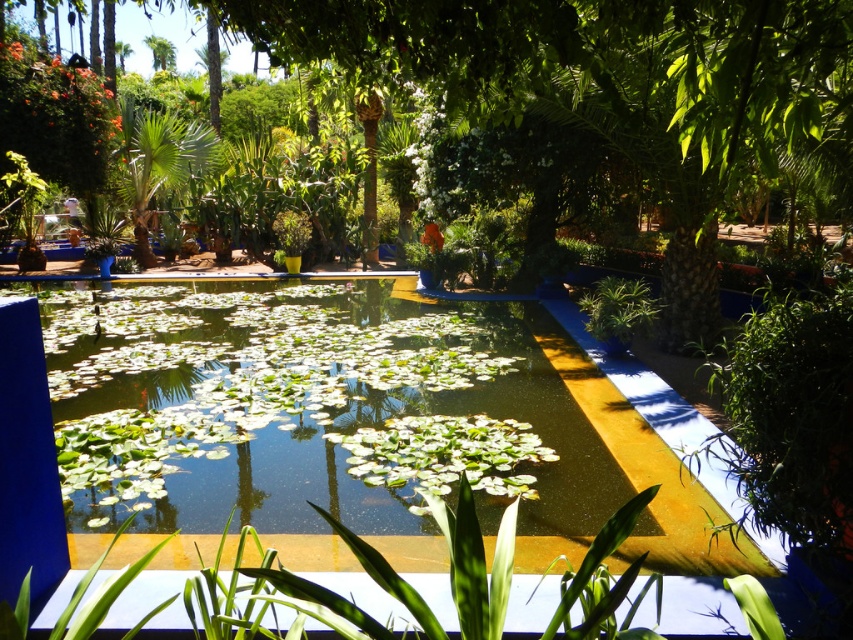
Question: Does green leafy pool at center have a larger size compared to green leafy tree at center?

Choices:
 (A) yes
 (B) no

Answer: (A)

Question: Among these objects, which one is nearest to the camera?

Choices:
 (A) green leafy pool at center
 (B) green leafy tree at center

Answer: (B)

Question: Which object appears farthest from the camera in this image?

Choices:
 (A) green leafy pool at center
 (B) green leafy tree at center

Answer: (A)

Question: Does green leafy pool at center have a lesser width compared to green leafy tree at center?

Choices:
 (A) yes
 (B) no

Answer: (B)

Question: Can you confirm if green leafy pool at center is wider than green leafy tree at center?

Choices:
 (A) no
 (B) yes

Answer: (B)

Question: Which object is closer to the camera taking this photo?

Choices:
 (A) green leafy pool at center
 (B) green leafy tree at center

Answer: (B)